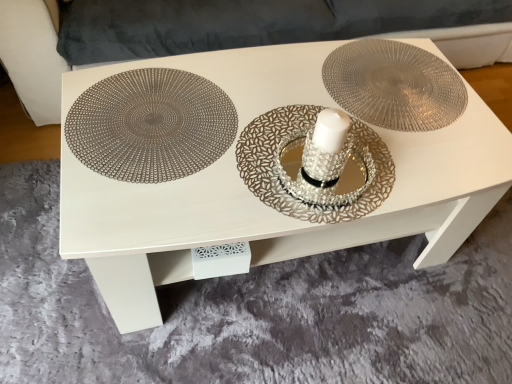
This screenshot has height=384, width=512. I want to click on empty space that is ontop of silver textured plate at center (from a real-world perspective), so click(x=291, y=153).